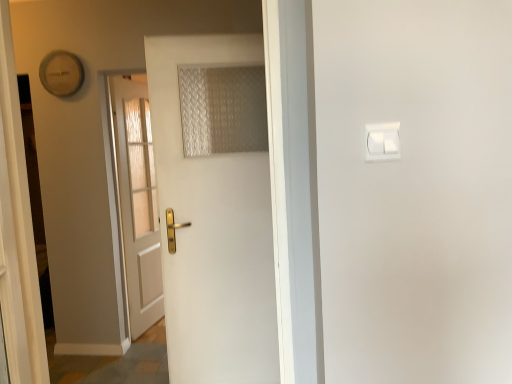
Question: Considering the relative sizes of wooden clock at upper left and white wooden door at center, the 1th door viewed from the back, in the image provided, is wooden clock at upper left smaller than white wooden door at center, the 1th door viewed from the back,?

Choices:
 (A) no
 (B) yes

Answer: (B)

Question: From a real-world perspective, is wooden clock at upper left beneath white wooden door at center, which ranks as the 2th door in right-to-left order?

Choices:
 (A) no
 (B) yes

Answer: (A)

Question: Is wooden clock at upper left far away from white wooden door at center, the first door in the left-to-right sequence?

Choices:
 (A) yes
 (B) no

Answer: (B)

Question: From a real-world perspective, is wooden clock at upper left over white wooden door at center, marked as the 2th door in a front-to-back arrangement?

Choices:
 (A) yes
 (B) no

Answer: (A)

Question: Is wooden clock at upper left taller than white wooden door at center, which ranks as the 2th door in right-to-left order?

Choices:
 (A) yes
 (B) no

Answer: (B)

Question: From a real-world perspective, is translucent fabric curtain at center positioned above or below white matte door at center, which is the second door in back-to-front order?

Choices:
 (A) above
 (B) below

Answer: (A)

Question: Considering the relative positions of translucent fabric curtain at center and white matte door at center, placed as the 1th door when sorted from front to back, in the image provided, is translucent fabric curtain at center to the left or to the right of white matte door at center, placed as the 1th door when sorted from front to back,?

Choices:
 (A) left
 (B) right

Answer: (B)

Question: Would you say translucent fabric curtain at center is inside or outside white matte door at center, placed as the 1th door when sorted from front to back?

Choices:
 (A) inside
 (B) outside

Answer: (B)

Question: Does point (251, 89) appear closer or farther from the camera than point (237, 253)?

Choices:
 (A) closer
 (B) farther

Answer: (A)

Question: Is point [x=185, y=215] closer or farther from the camera than point [x=134, y=261]?

Choices:
 (A) farther
 (B) closer

Answer: (B)

Question: Is white matte door at center, placed as the second door when sorted from left to right, bigger or smaller than white wooden door at center, the first door in the left-to-right sequence?

Choices:
 (A) big
 (B) small

Answer: (B)

Question: From their relative heights in the image, would you say white matte door at center, placed as the 1th door when sorted from front to back, is taller or shorter than white wooden door at center, the 1th door viewed from the back?

Choices:
 (A) tall
 (B) short

Answer: (B)

Question: Considering the relative positions of white matte door at center, arranged as the first door when viewed from the right, and white wooden door at center, the 1th door viewed from the back, in the image provided, is white matte door at center, arranged as the first door when viewed from the right, to the left or to the right of white wooden door at center, the 1th door viewed from the back,?

Choices:
 (A) right
 (B) left

Answer: (A)

Question: From a real-world perspective, is translucent fabric curtain at center positioned above or below white wooden door at center, which ranks as the 2th door in right-to-left order?

Choices:
 (A) below
 (B) above

Answer: (B)

Question: Considering the positions of point (258, 110) and point (140, 129), is point (258, 110) closer or farther from the camera than point (140, 129)?

Choices:
 (A) closer
 (B) farther

Answer: (A)